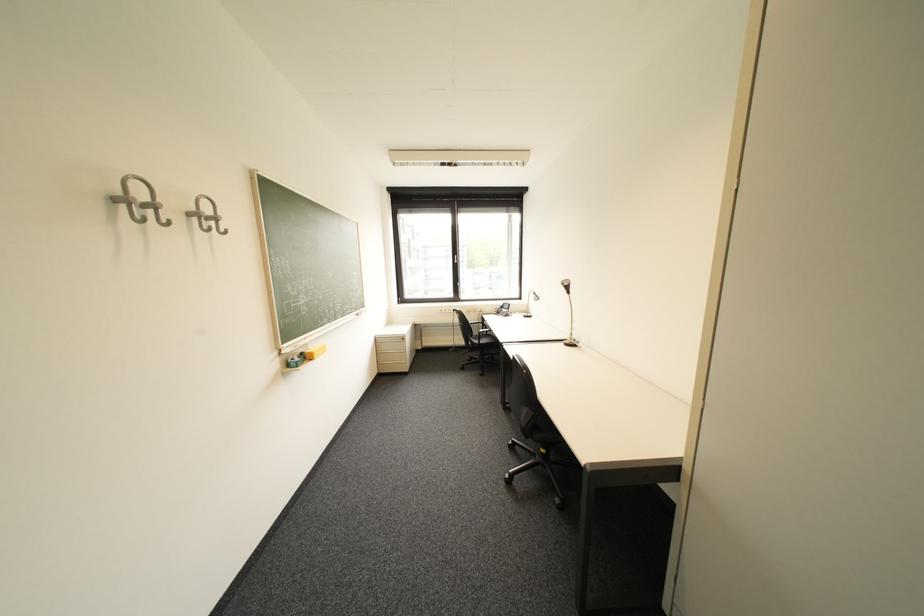
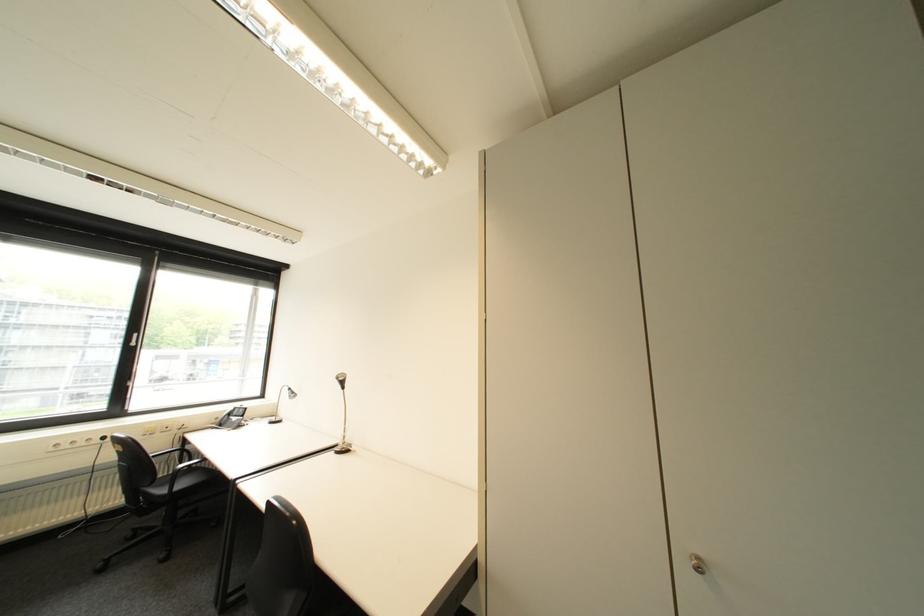
Where in the second image is the point corresponding to point (515, 304) from the first image?

(246, 408)